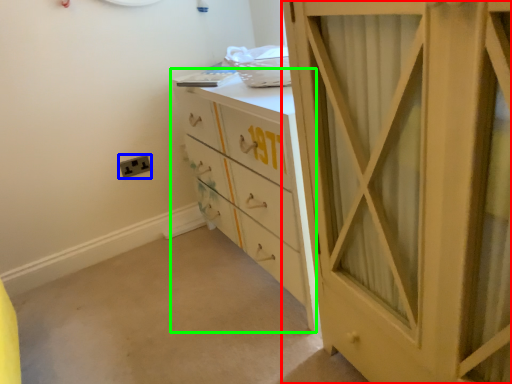
Question: Considering the real-world distances, which object is farthest from cupboard (highlighted by a red box)? electric outlet (highlighted by a blue box) or chest of drawers (highlighted by a green box)?

Choices:
 (A) electric outlet
 (B) chest of drawers

Answer: (A)